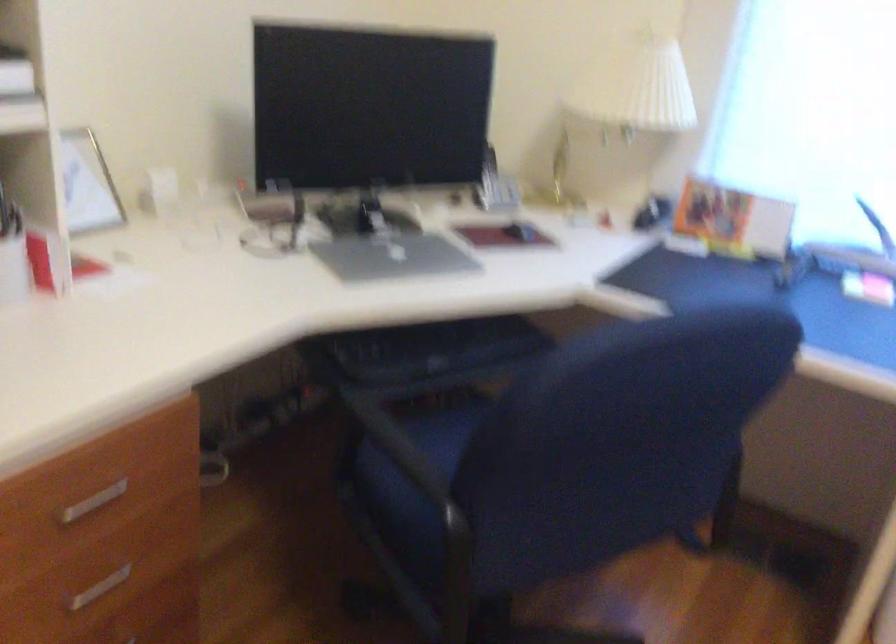
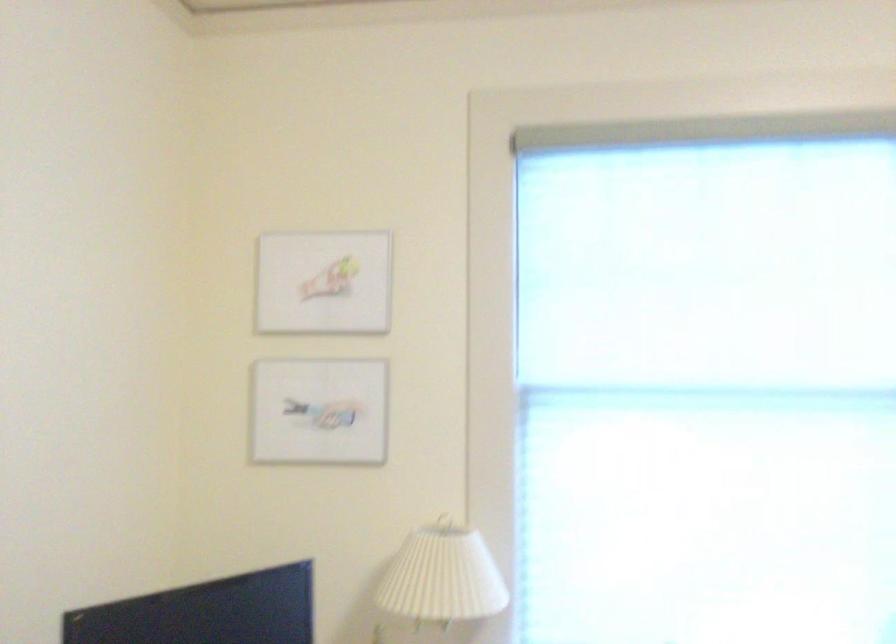
Where in the second image is the point corresponding to the point at 627,86 from the first image?

(443, 576)